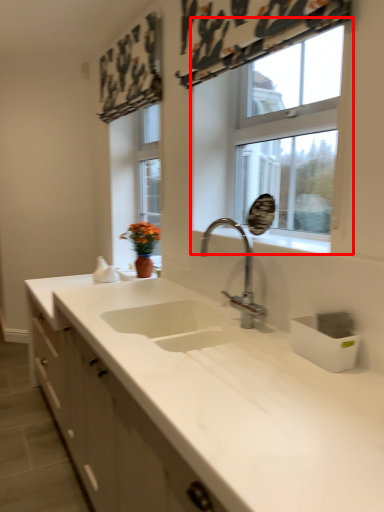
Question: From the image's perspective, what is the correct spatial relationship of window (annotated by the red box) in relation to tap?

Choices:
 (A) below
 (B) above

Answer: (B)